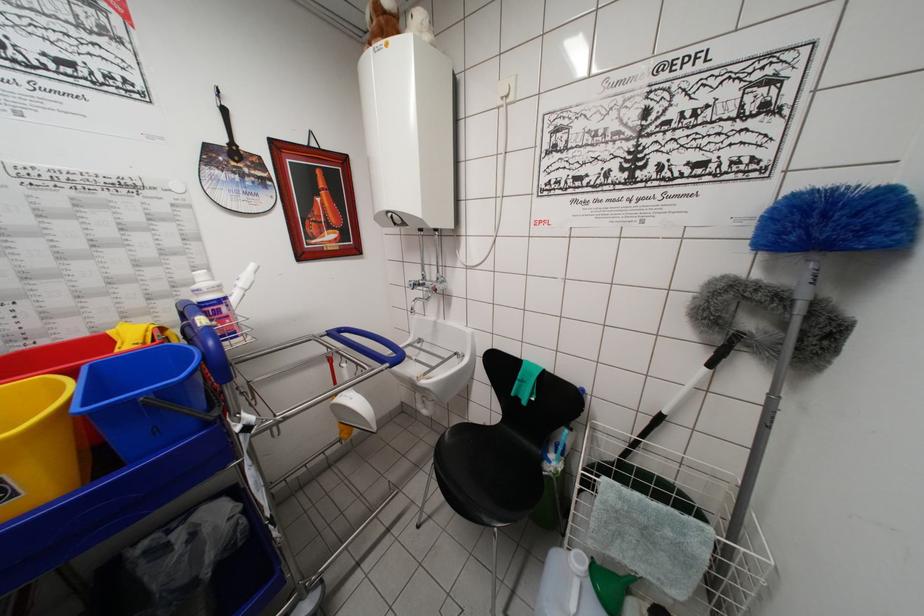
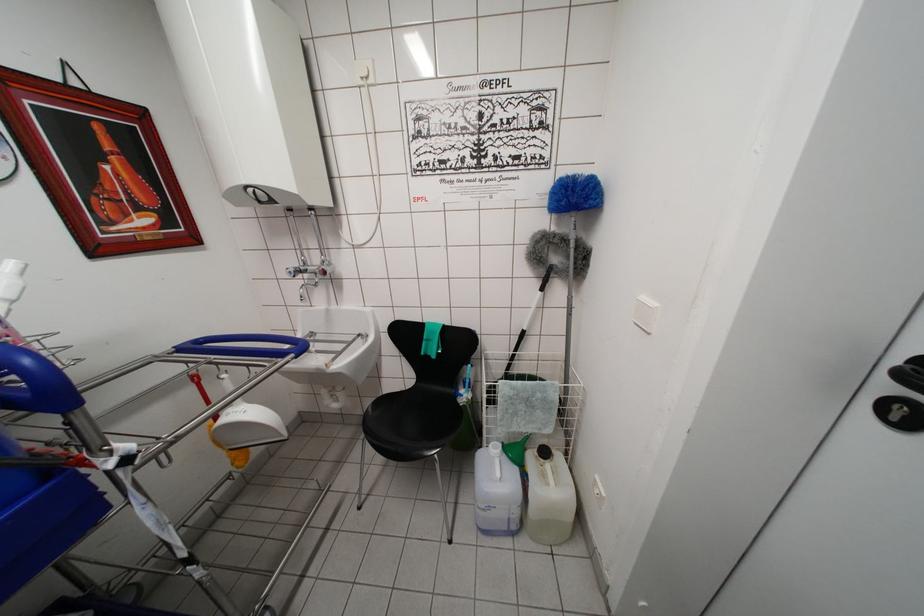
Where in the second image is the point corresponding to (432,374) from the first image?

(338, 360)